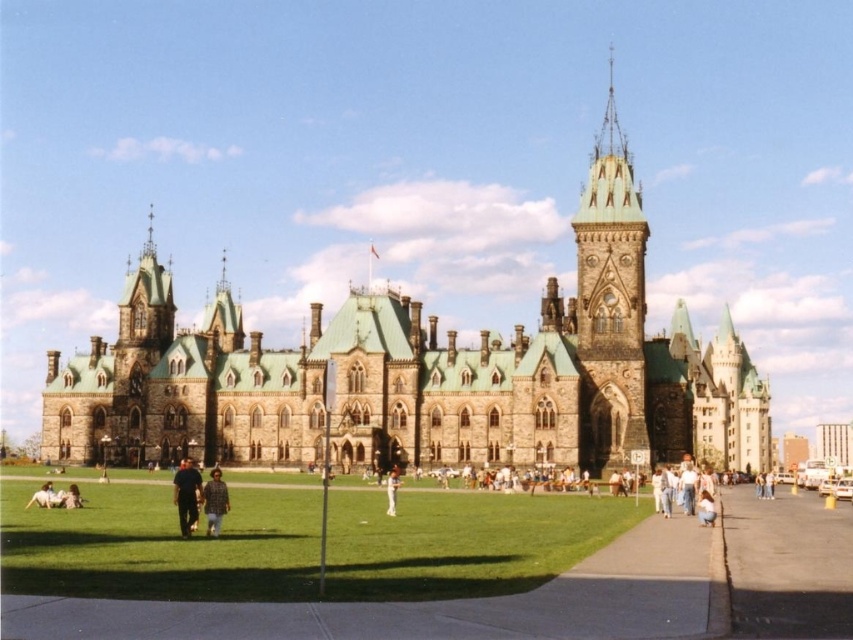
Can you confirm if dark blue jeans at center is positioned to the left of light brown fabric pants at lower left?

Incorrect, dark blue jeans at center is not on the left side of light brown fabric pants at lower left.

Is dark blue jeans at center behind light brown fabric pants at lower left?

No, it is not.

Is point (184, 477) positioned after point (48, 488)?

No.

Where is `dark blue jeans at center`? dark blue jeans at center is located at coordinates (186, 496).

Does dark blue jeans at center appear on the right side of light brown leather jacket at lower left?

Indeed, dark blue jeans at center is positioned on the right side of light brown leather jacket at lower left.

How distant is dark blue jeans at center from light brown leather jacket at lower left?

dark blue jeans at center is 30.84 feet from light brown leather jacket at lower left.

Is point (184, 525) farther from viewer compared to point (71, 506)?

No, (184, 525) is closer to viewer.

The height and width of the screenshot is (640, 853). Find the location of `dark blue jeans at center`. dark blue jeans at center is located at coordinates (186, 496).

Can you confirm if green grass at lower center is shorter than asphalt at lower right?

Yes.

The width and height of the screenshot is (853, 640). I want to click on green grass at lower center, so click(x=160, y=545).